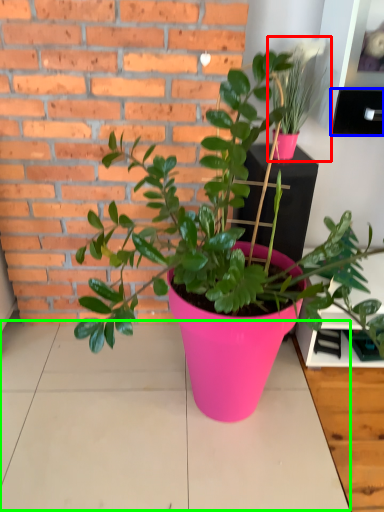
Question: Which object is the closest to the houseplant (highlighted by a red box)? Choose among these: shelf (highlighted by a blue box) or table top (highlighted by a green box).

Choices:
 (A) shelf
 (B) table top

Answer: (A)